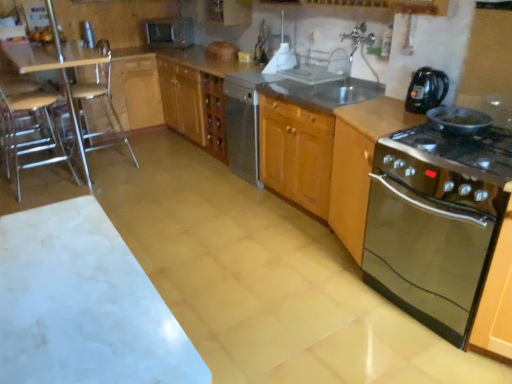
This screenshot has height=384, width=512. In order to click on free space behind white marble table at lower left, which is counted as the first table, starting from the right in this screenshot , I will do `click(217, 302)`.